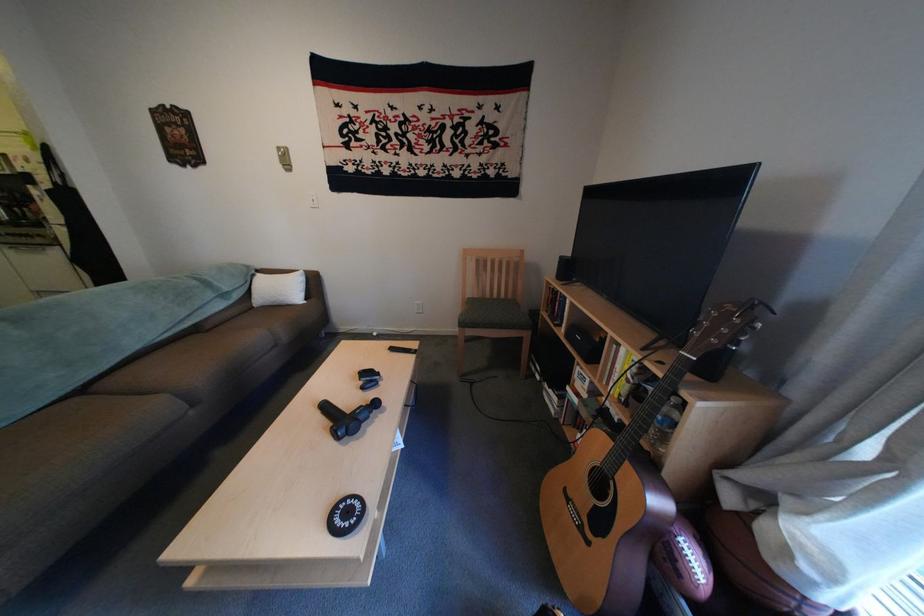
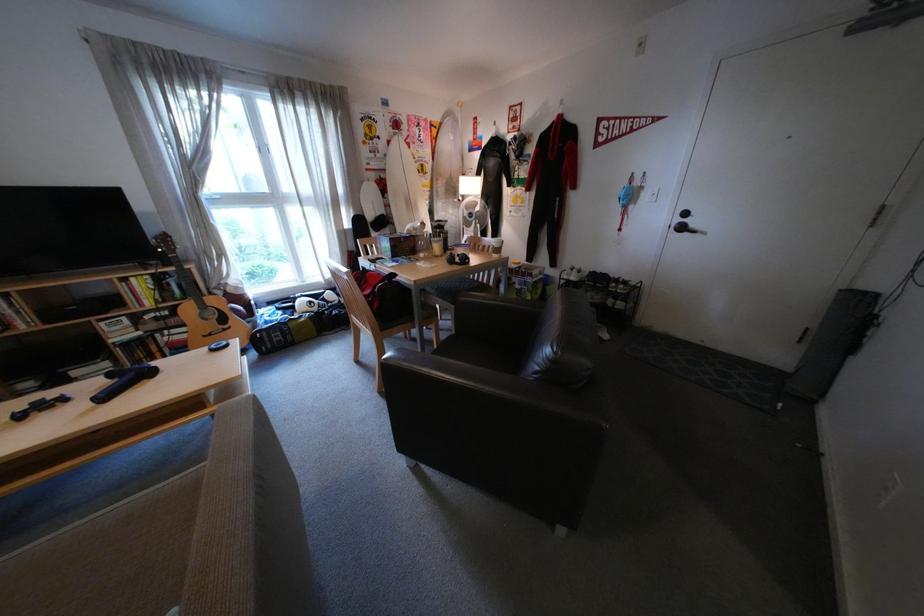
The point at [570,406] is marked in the first image. Where is the corresponding point in the second image?

(126, 367)